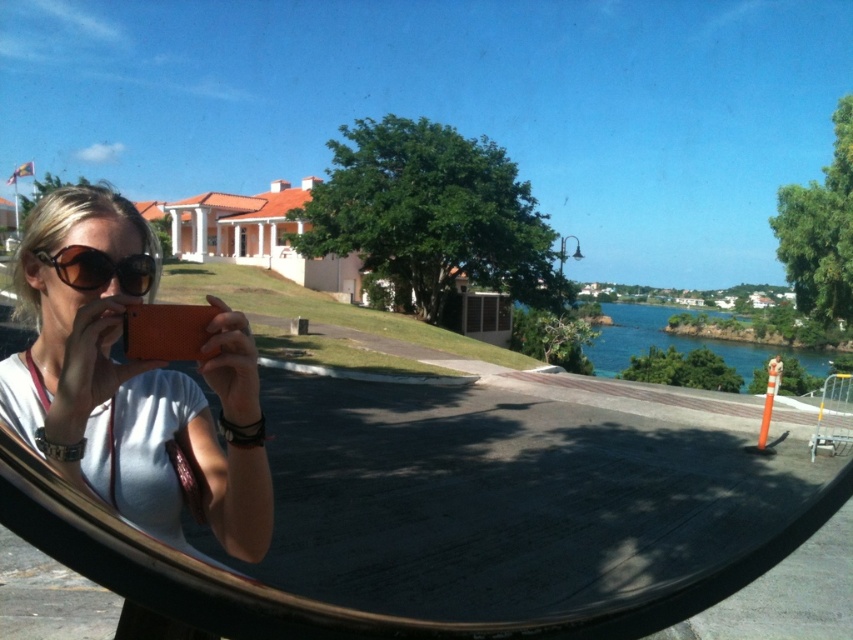
You are a photographer trying to capture the peach building in the background. You have a matte orange phone at center and brown matte sunglasses at center. Which object should you adjust to get a better view of the building?

You should adjust the matte orange phone at center since it is to the left of the brown matte sunglasses at center, blocking your view of the peach building.

You are holding a matte orange phone at center and brown matte sunglasses at center. If you want to place both items side by side on a shelf that can only accommodate items up to the size of the sunglasses, will they both fit?

The matte orange phone at center is wider than the brown matte sunglasses at center. Since the shelf can only fit items up to the size of the sunglasses, the phone is too wide and won

You are a photographer trying to capture the peach building with the terracotta roof in the background using the matte orange phone at center. However, the brown matte sunglasses at center are blocking the view. Can you move the sunglasses to the side to get a clear shot?

The matte orange phone at center is larger in size than brown matte sunglasses at center. Since the phone is bigger, you can move the smaller sunglasses out of the way to get an unobstructed view of the building.